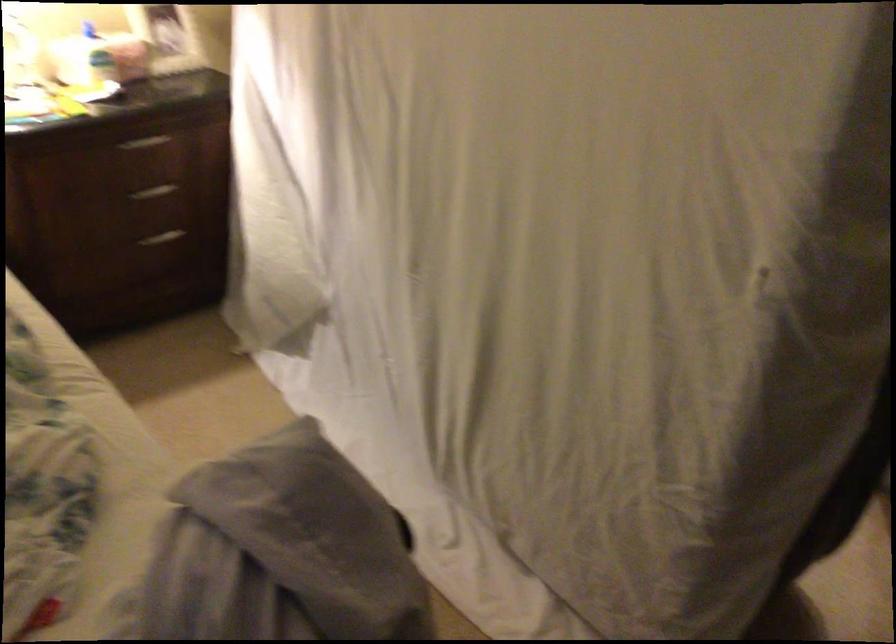
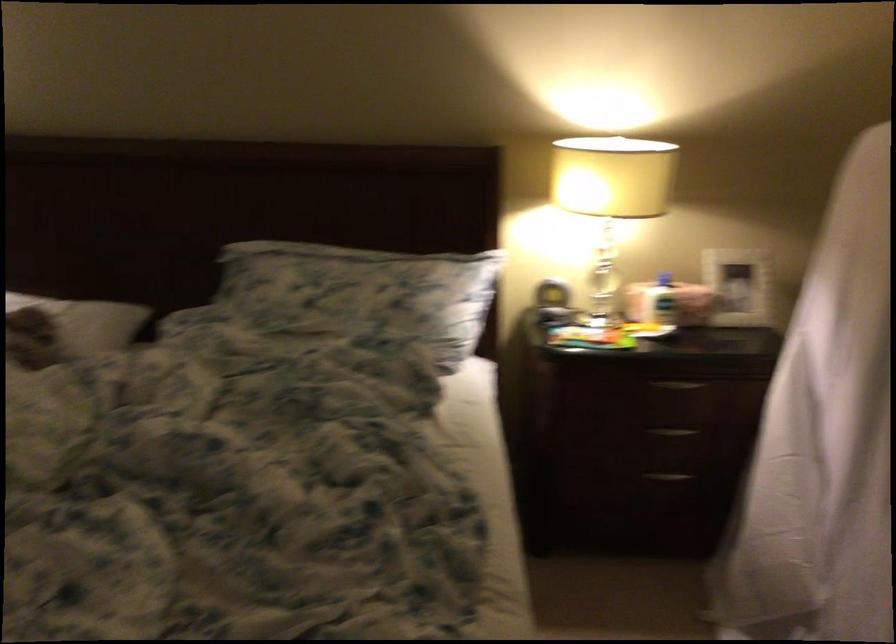
Where in the second image is the point corresponding to the point at 143,147 from the first image?

(679, 384)